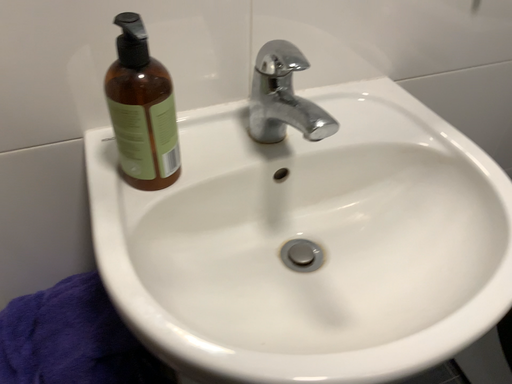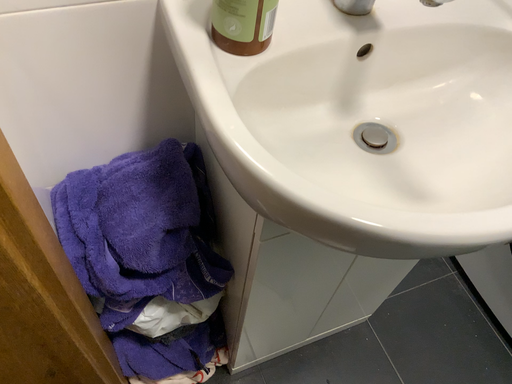
Question: How did the camera likely rotate when shooting the video?

Choices:
 (A) rotated downward
 (B) rotated upward

Answer: (A)